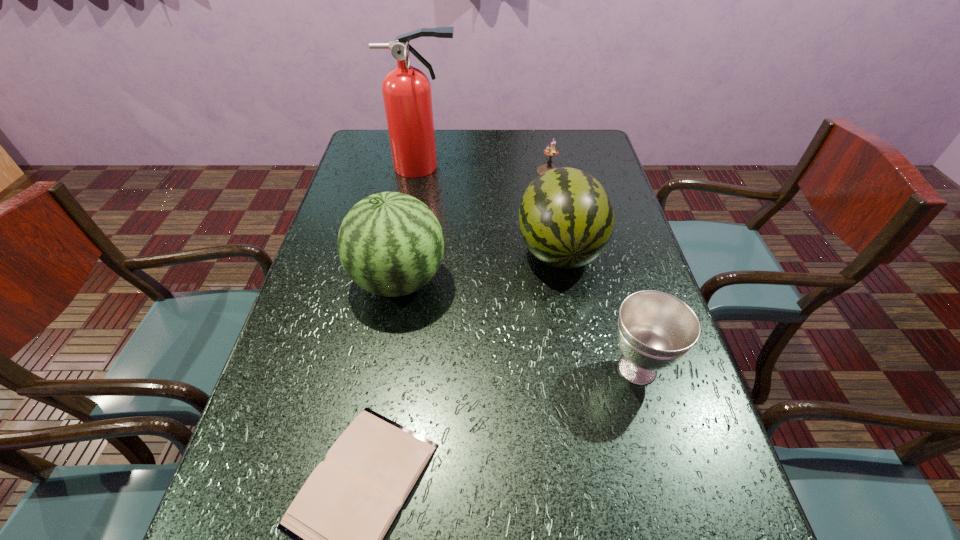
At what (x,y) coordinates should I click in order to perform the action: click on fire extinguisher. Please return your answer as a coordinate pair (x, y). The height and width of the screenshot is (540, 960). Looking at the image, I should click on (406, 90).

This screenshot has width=960, height=540. Find the location of `the fifth shortest object`. the fifth shortest object is located at coordinates (390, 244).

This screenshot has width=960, height=540. I want to click on the taller watermelon, so click(390, 244).

Locate an element on the screen. the third tallest object is located at coordinates (566, 218).

This screenshot has height=540, width=960. Find the location of `the right watermelon`. the right watermelon is located at coordinates (566, 218).

Locate an element on the screen. Image resolution: width=960 pixels, height=540 pixels. chalice is located at coordinates (655, 329).

The width and height of the screenshot is (960, 540). What are the coordinates of `the fifth farthest object` in the screenshot? It's located at (655, 329).

Where is `candle holder`? This screenshot has width=960, height=540. candle holder is located at coordinates (549, 151).

The height and width of the screenshot is (540, 960). Identify the location of vacant space positioned on the right of the tallest object. (516, 167).

What are the coordinates of `free space located on the back of the fifth shortest object` in the screenshot? It's located at (414, 193).